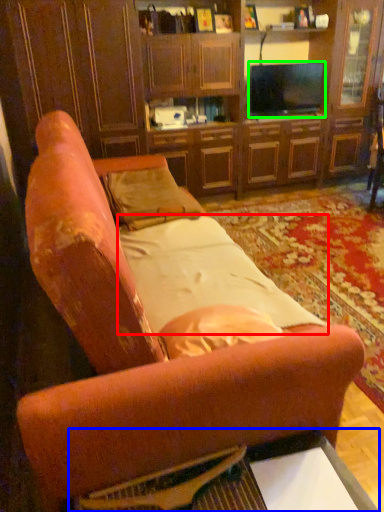
Question: Which object is the farthest from sheet (highlighted by a red box)? Choose among these: table (highlighted by a blue box) or television (highlighted by a green box).

Choices:
 (A) table
 (B) television

Answer: (B)